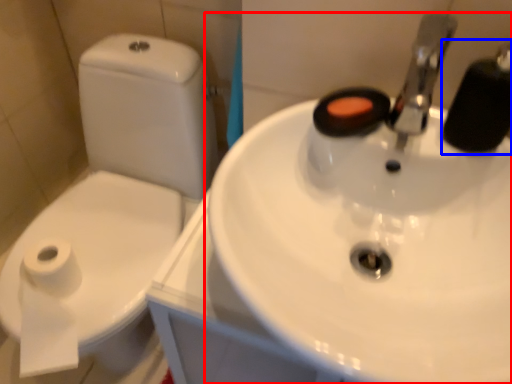
Question: Among these objects, which one is farthest to the camera, sink (highlighted by a red box) or plumbing fixture (highlighted by a blue box)?

Choices:
 (A) sink
 (B) plumbing fixture

Answer: (B)